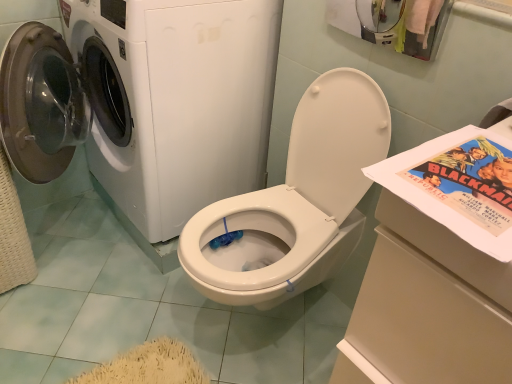
Question: From a real-world perspective, relative to matte paper comic book at right, is white glossy washing machine at left vertically above or below?

Choices:
 (A) below
 (B) above

Answer: (A)

Question: Considering the positions of white glossy washing machine at left and matte paper comic book at right in the image, is white glossy washing machine at left bigger or smaller than matte paper comic book at right?

Choices:
 (A) small
 (B) big

Answer: (B)

Question: Estimate the real-world distances between objects in this image. Which object is farther from the white glossy washer at upper left?

Choices:
 (A) matte paper comic book at right
 (B) white glossy washing machine at left

Answer: (A)

Question: Which object is positioned closest to the white glossy washer at upper left?

Choices:
 (A) matte paper comic book at right
 (B) white glossy washing machine at left

Answer: (B)